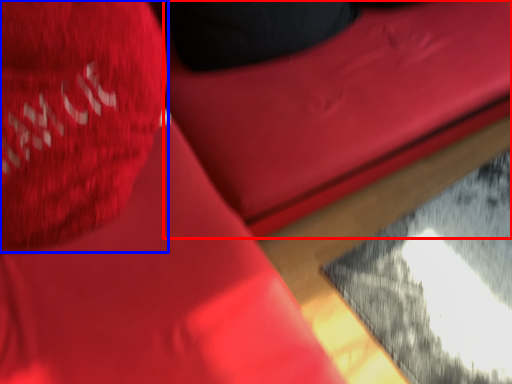
Question: Which point is further to the camera, bean bag chair (highlighted by a red box) or throw pillow (highlighted by a blue box)?

Choices:
 (A) bean bag chair
 (B) throw pillow

Answer: (A)